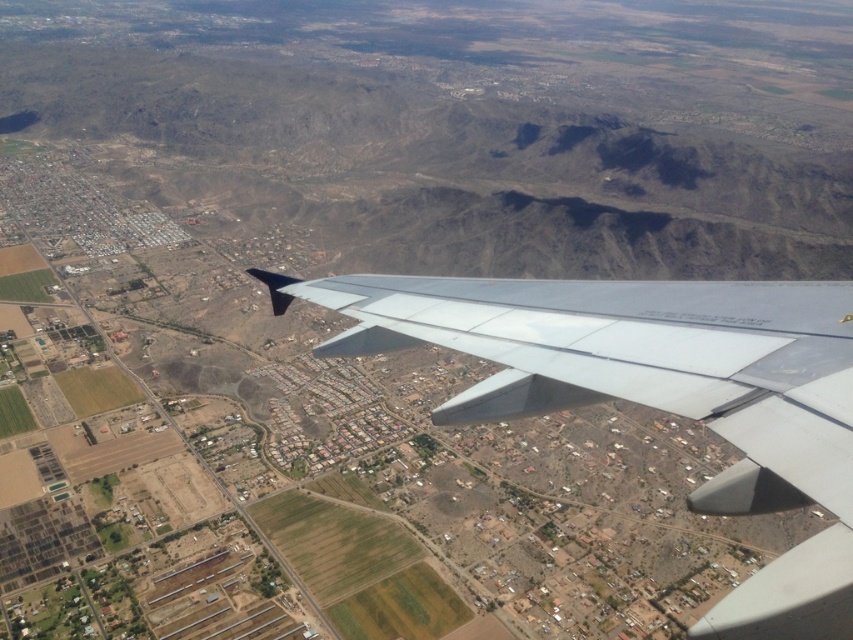
Question: Is metallic gray wing at center in front of silver metallic wing at center?

Choices:
 (A) no
 (B) yes

Answer: (B)

Question: Observing the image, what is the correct spatial positioning of metallic gray wing at center in reference to silver metallic wing at center?

Choices:
 (A) below
 (B) above

Answer: (A)

Question: Which point is farther from the camera taking this photo?

Choices:
 (A) (688, 284)
 (B) (747, 372)

Answer: (A)

Question: Is metallic gray wing at center below silver metallic wing at center?

Choices:
 (A) no
 (B) yes

Answer: (B)